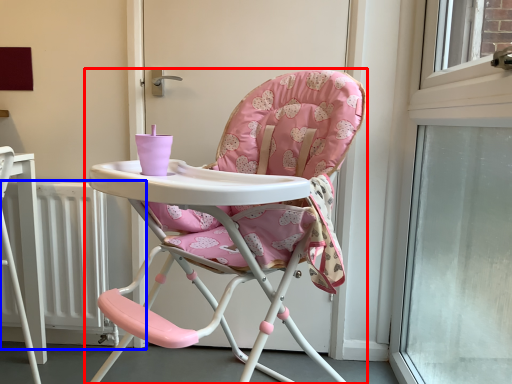
Question: Which point is closer to the camera, chair (highlighted by a red box) or radiator (highlighted by a blue box)?

Choices:
 (A) chair
 (B) radiator

Answer: (A)